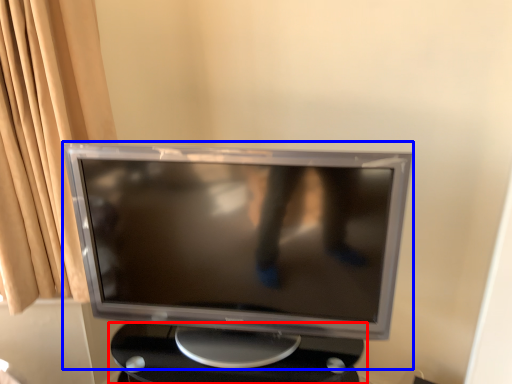
Question: Which of the following is the closest to the observer, table (highlighted by a red box) or computer monitor (highlighted by a blue box)?

Choices:
 (A) table
 (B) computer monitor

Answer: (B)